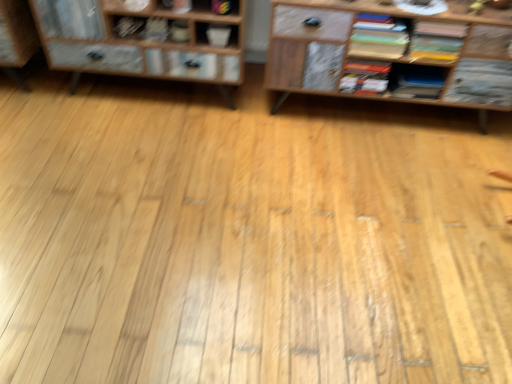
Where is `vacant space in front of wooden cabinet at left`? vacant space in front of wooden cabinet at left is located at coordinates coord(139,163).